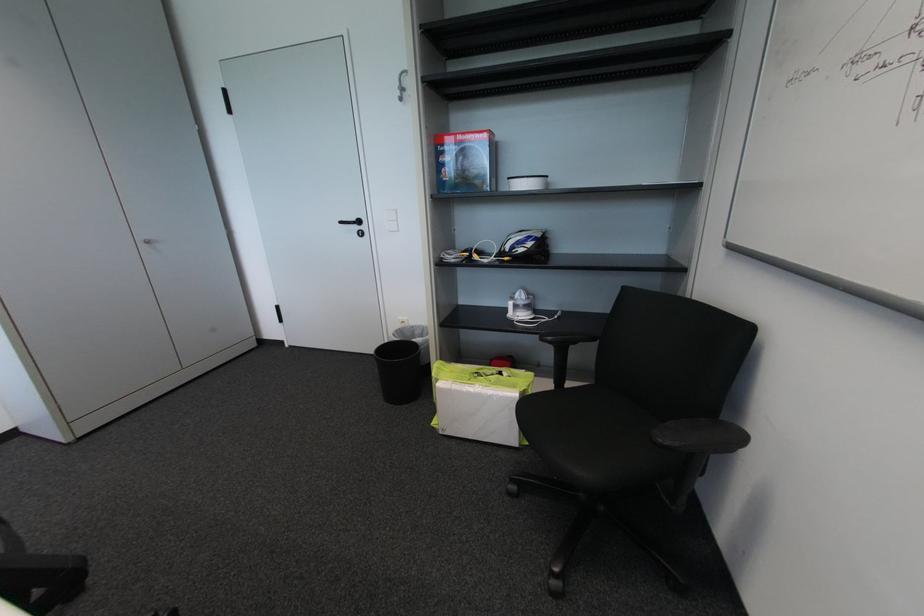
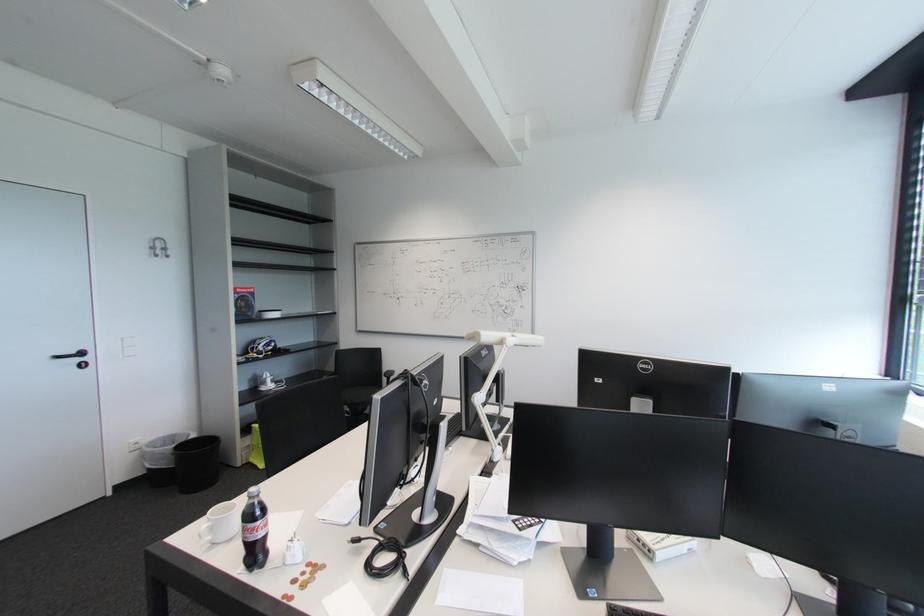
Find the pixel in the second image that matches (466,139) in the first image.

(246, 292)